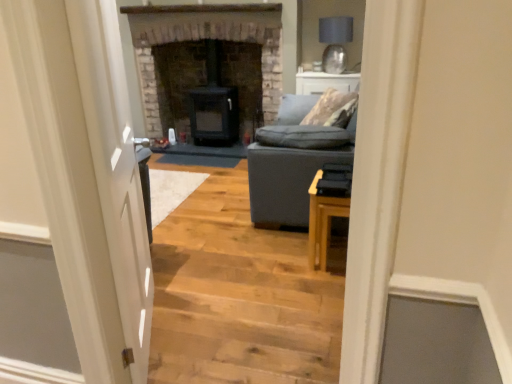
Question: Is dark gray stone fireplace at center, arranged as the 1th fireplace when viewed from the left, oriented away from black matte wood stove at center, which ranks as the 1th fireplace in right-to-left order?

Choices:
 (A) no
 (B) yes

Answer: (B)

Question: Is dark gray stone fireplace at center, arranged as the 1th fireplace when viewed from the left, at the left side of black matte wood stove at center, which ranks as the 1th fireplace in right-to-left order?

Choices:
 (A) yes
 (B) no

Answer: (A)

Question: Is dark gray stone fireplace at center, arranged as the 1th fireplace when viewed from the left, next to black matte wood stove at center, which ranks as the 1th fireplace in right-to-left order?

Choices:
 (A) yes
 (B) no

Answer: (B)

Question: Is dark gray stone fireplace at center, positioned as the 2th fireplace in right-to-left order, positioned behind black matte wood stove at center, which ranks as the 1th fireplace in right-to-left order?

Choices:
 (A) no
 (B) yes

Answer: (A)

Question: Does dark gray stone fireplace at center, positioned as the 2th fireplace in right-to-left order, lie in front of black matte wood stove at center, which appears as the 2th fireplace when viewed from the left?

Choices:
 (A) yes
 (B) no

Answer: (A)

Question: Looking at their shapes, would you say light wood stairwell at center is wider or thinner than dark gray fabric couch at center?

Choices:
 (A) wide
 (B) thin

Answer: (A)

Question: Is light wood stairwell at center inside or outside of dark gray fabric couch at center?

Choices:
 (A) outside
 (B) inside

Answer: (A)

Question: Considering the positions of light wood stairwell at center and dark gray fabric couch at center in the image, is light wood stairwell at center taller or shorter than dark gray fabric couch at center?

Choices:
 (A) tall
 (B) short

Answer: (B)

Question: Relative to dark gray fabric couch at center, is light wood stairwell at center in front or behind?

Choices:
 (A) front
 (B) behind

Answer: (A)

Question: In the image, is white glossy door at left on the left side or the right side of matte gray lampshade at upper right?

Choices:
 (A) right
 (B) left

Answer: (B)

Question: From the image's perspective, relative to matte gray lampshade at upper right, is white glossy door at left above or below?

Choices:
 (A) below
 (B) above

Answer: (A)

Question: Which is correct: white glossy door at left is inside matte gray lampshade at upper right, or outside of it?

Choices:
 (A) inside
 (B) outside

Answer: (B)

Question: From a real-world perspective, is white glossy door at left above or below matte gray lampshade at upper right?

Choices:
 (A) below
 (B) above

Answer: (A)

Question: From the image's perspective, is black matte wood stove at center, which appears as the 2th fireplace when viewed from the left, positioned above or below white glossy door at left?

Choices:
 (A) below
 (B) above

Answer: (B)

Question: Considering their positions, is black matte wood stove at center, which appears as the 2th fireplace when viewed from the left, located in front of or behind white glossy door at left?

Choices:
 (A) front
 (B) behind

Answer: (B)